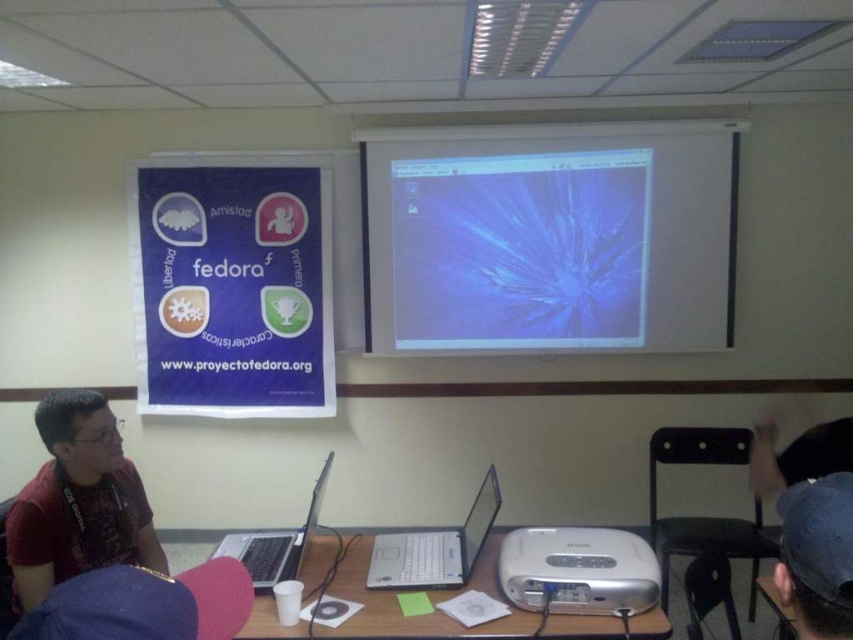
You are standing in the classroom facing the wall with the banner. The projector is located at the back of the room. You want to project a presentation onto the screen on the right side of the room. However, the projector is currently pointing towards the matte paper poster at upper left. To adjust the projector so it faces the screen on the right, in which direction should you move the projector?

Since the matte paper poster at upper left is positioned at point coordinates 0.455 on the x axis and 0.274 on the y axis, the projector needs to be moved to the right and downward to face the screen on the right side of the room.

You are a student sitting in the classroom and want to see both the white matte projection screen at upper center and the matte red shirt at left clearly. However, the screen is blocking your view of the shirt. Can you adjust your position so that you can see both without moving the screen or the shirt?

The matte red shirt at left is behind the white matte projection screen at upper center. To see both, you can move to the side so that the screen is no longer directly blocking your view of the shirt.